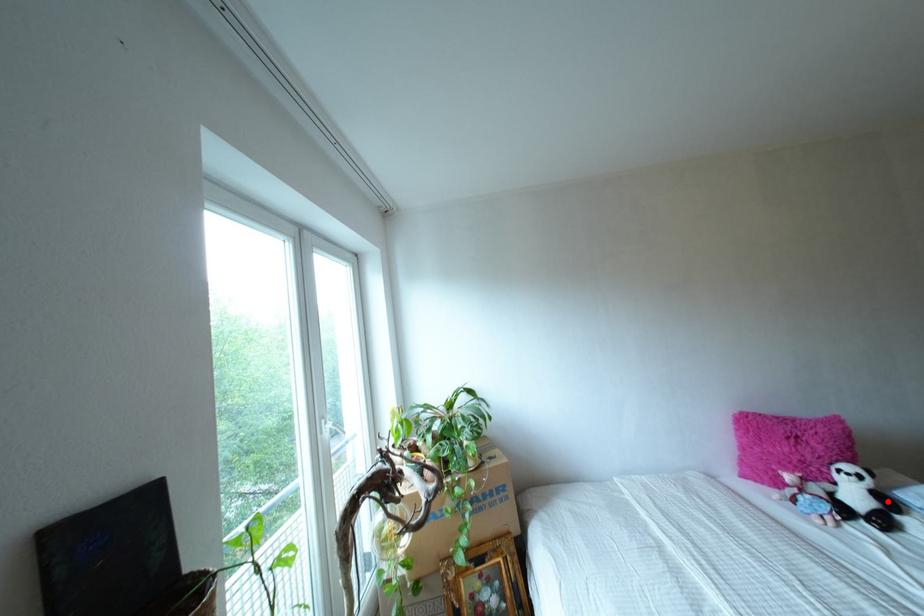
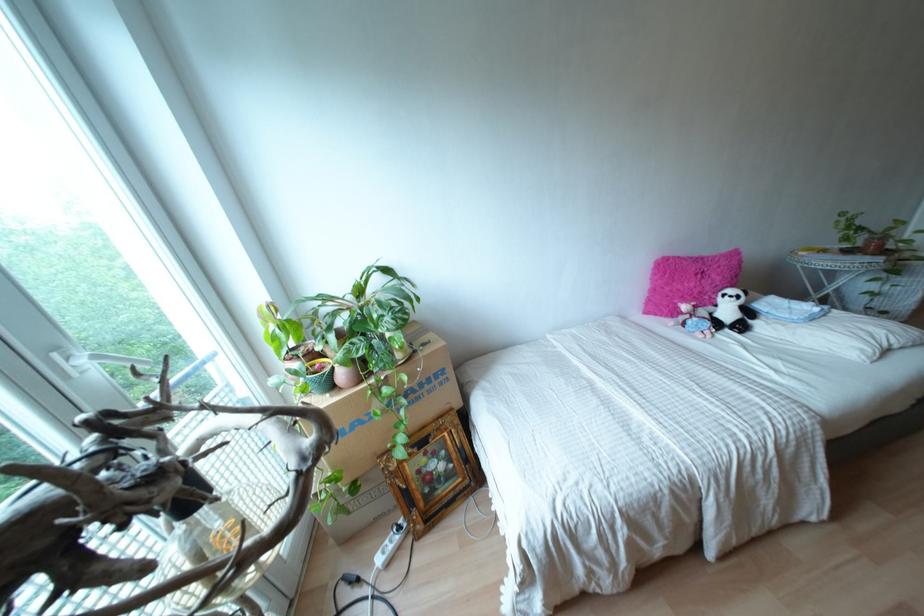
Question: I am providing you with two images of the same scene from different viewpoints. Given a red point in image1, look at the same physical point in image2. Is it:

Choices:
 (A) Closer to the viewpoint
 (B) Farther from the viewpoint

Answer: (B)